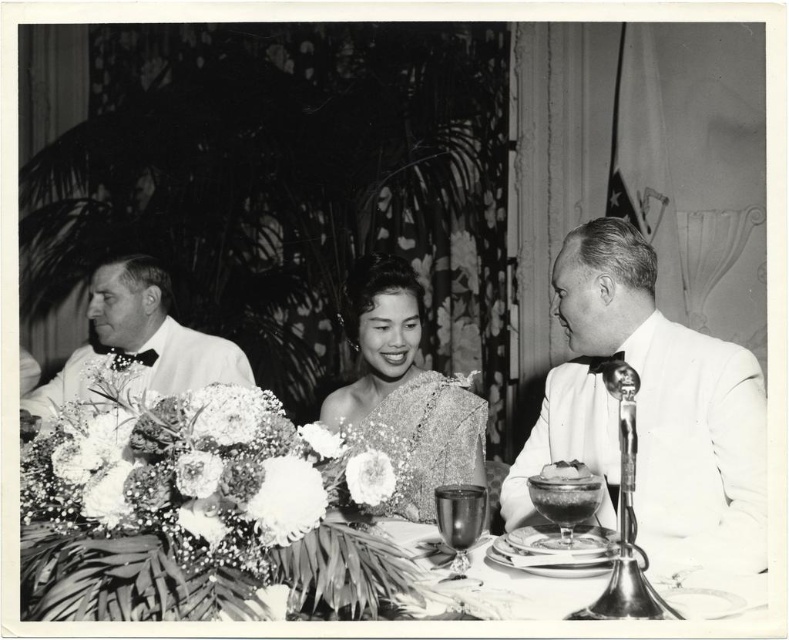
Question: Which point is closer to the camera?

Choices:
 (A) satin cake at center
 (B) shiny silver plate at center
 (C) sequined dress at center

Answer: (B)

Question: In this image, where is silky satin dress at center located relative to satin cake at center?

Choices:
 (A) below
 (B) above

Answer: (B)

Question: Which of these objects is positioned farthest from the silky satin dress at center?

Choices:
 (A) white satin suit at right
 (B) sequined dress at center

Answer: (B)

Question: Which point is farther to the camera?

Choices:
 (A) silky satin dress at center
 (B) sequined dress at center
 (C) shiny silver plate at center
 (D) matte white suit at left

Answer: (D)

Question: Can you confirm if white satin suit at right is wider than sequined dress at center?

Choices:
 (A) yes
 (B) no

Answer: (A)

Question: Can you confirm if sequined dress at center is positioned below satin cake at center?

Choices:
 (A) yes
 (B) no

Answer: (B)